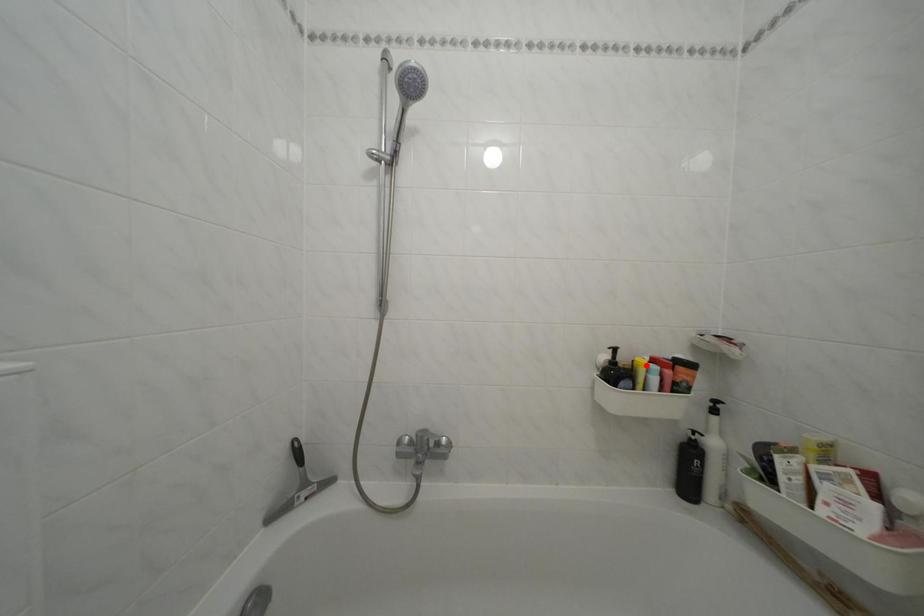
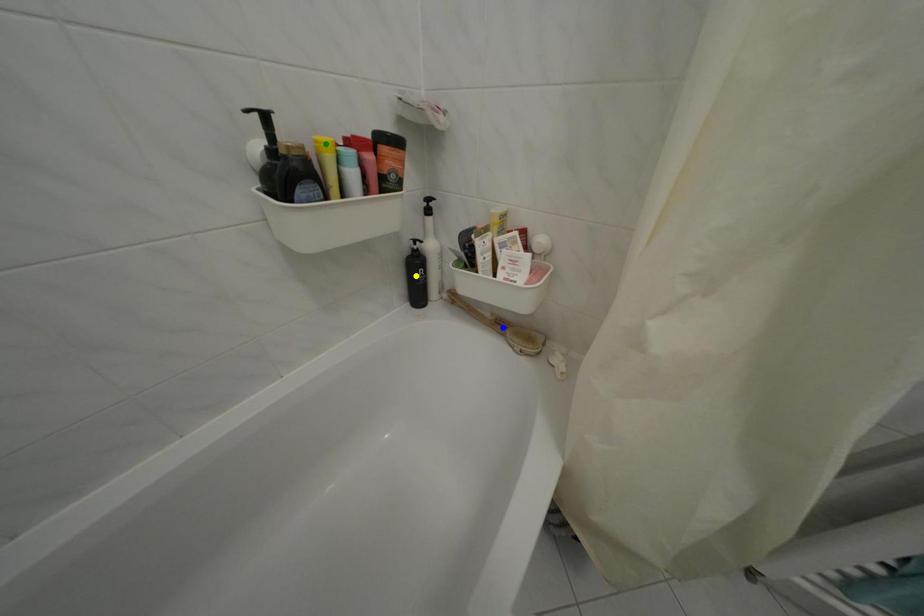
Question: I am providing you with two images of the same scene from different viewpoints. A red point is marked on the first image. You are given multiple points on the second image. Which point in image 2 represents the same 3d spot as the red point in image 1?

Choices:
 (A) green point
 (B) yellow point
 (C) blue point

Answer: (A)